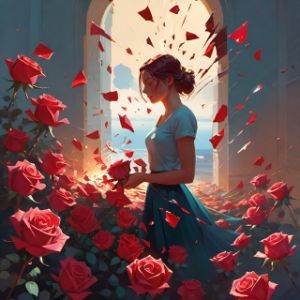
Identify the location of wall. The width and height of the screenshot is (300, 300). pyautogui.click(x=258, y=57).